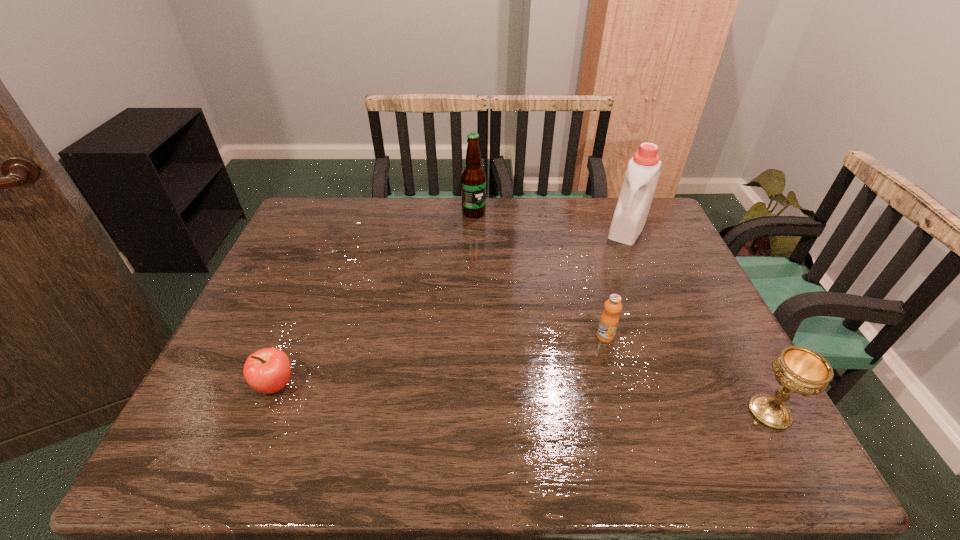
At what (x,y) coordinates should I click in order to perform the action: click on apple. Please return your answer as a coordinate pair (x, y). Looking at the image, I should click on (268, 370).

Where is `the leftmost object`? the leftmost object is located at coordinates (268, 370).

Identify the location of the rightmost object. (801, 370).

In order to click on chalice in this screenshot , I will do `click(801, 370)`.

You are a GUI agent. You are given a task and a screenshot of the screen. Output one action in this format:
    pyautogui.click(x=<x>, y=<y>)
    Task: Click on the detergent
    This screenshot has height=540, width=960.
    Given the screenshot: What is the action you would take?
    pyautogui.click(x=637, y=191)

The width and height of the screenshot is (960, 540). I want to click on the third object from right to left, so click(609, 320).

Where is `the second shortest object`? The image size is (960, 540). the second shortest object is located at coordinates (609, 320).

You are a GUI agent. You are given a task and a screenshot of the screen. Output one action in this format:
    pyautogui.click(x=<x>, y=<y>)
    Task: Click on the beer bottle
    The height and width of the screenshot is (540, 960).
    Given the screenshot: What is the action you would take?
    pyautogui.click(x=473, y=177)

This screenshot has width=960, height=540. Identify the location of vacant space located 0.210m on the right of the leftmost object. (390, 385).

Where is `free region located 0.130m on the left of the chalice`? free region located 0.130m on the left of the chalice is located at coordinates (684, 413).